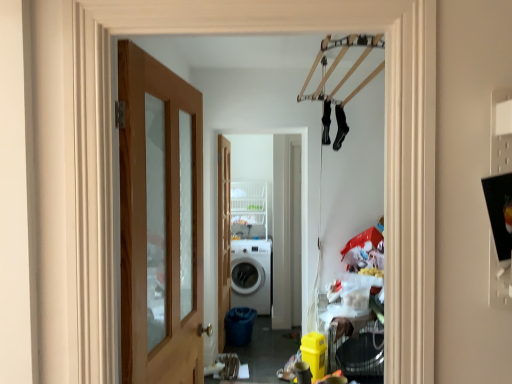
Describe the element at coordinates (224, 236) in the screenshot. I see `wooden door at center, placed as the 2th door when sorted from front to back` at that location.

What do you see at coordinates (160, 222) in the screenshot?
I see `wooden door at left, which is counted as the first door, starting from the front` at bounding box center [160, 222].

Locate an element on the screen. This screenshot has height=384, width=512. white wire shelf at center is located at coordinates 249,203.

From the image's perspective, is white matte washing machine at center under wooden door at center, placed as the 2th door when sorted from front to back?

Yes, from the image's perspective, white matte washing machine at center is beneath wooden door at center, placed as the 2th door when sorted from front to back.

Is white matte washing machine at center at the right side of wooden door at center, arranged as the 1th door when viewed from the back?

Result: Yes, white matte washing machine at center is to the right of wooden door at center, arranged as the 1th door when viewed from the back.

Consider the image. Which of these two, white matte washing machine at center or wooden door at center, placed as the 2th door when sorted from front to back, is thinner?

With smaller width is wooden door at center, placed as the 2th door when sorted from front to back.

I want to click on door that is the 2nd object located in front of the white matte washing machine at center, so click(160, 222).

Looking at their sizes, would you say wooden door at left, marked as the 2th door in a back-to-front arrangement, is wider or thinner than white matte washing machine at center?

Clearly, wooden door at left, marked as the 2th door in a back-to-front arrangement, has less width compared to white matte washing machine at center.

Which is more to the left, white matte washing machine at center or white wire shelf at center?

Positioned to the left is white wire shelf at center.

Considering the relative sizes of white matte washing machine at center and white wire shelf at center in the image provided, is white matte washing machine at center smaller than white wire shelf at center?

Incorrect, white matte washing machine at center is not smaller in size than white wire shelf at center.

Where is `shelf located behind the white matte washing machine at center`? shelf located behind the white matte washing machine at center is located at coordinates (249, 203).

Can you confirm if white matte washing machine at center is shorter than white wire shelf at center?

In fact, white matte washing machine at center may be taller than white wire shelf at center.

Considering the sizes of objects white wire shelf at center and wooden door at center, placed as the 2th door when sorted from front to back, in the image provided, who is thinner, white wire shelf at center or wooden door at center, placed as the 2th door when sorted from front to back,?

wooden door at center, placed as the 2th door when sorted from front to back, is thinner.

Can you confirm if white wire shelf at center is shorter than wooden door at center, arranged as the 1th door when viewed from the back?

Yes.

Is wooden door at center, placed as the 2th door when sorted from front to back, completely or partially inside white wire shelf at center?

No, wooden door at center, placed as the 2th door when sorted from front to back, is located outside of white wire shelf at center.

Considering the relative sizes of white wire shelf at center and wooden door at center, placed as the 2th door when sorted from front to back, in the image provided, is white wire shelf at center smaller than wooden door at center, placed as the 2th door when sorted from front to back,?

Indeed, white wire shelf at center has a smaller size compared to wooden door at center, placed as the 2th door when sorted from front to back.

From the image's perspective, is wooden door at left, which is counted as the first door, starting from the front, located above or below white wire shelf at center?

Based on their image positions, wooden door at left, which is counted as the first door, starting from the front, is located beneath white wire shelf at center.

Which is closer to the camera, (150,295) or (236,187)?

Point (150,295)

At what (x,y) coordinates should I click in order to perform the action: click on shelf below the wooden door at left, which is counted as the first door, starting from the front (from a real-world perspective). Please return your answer as a coordinate pair (x, y). Looking at the image, I should click on (249, 203).

Is wooden door at left, marked as the 2th door in a back-to-front arrangement, positioned far away from white wire shelf at center?

wooden door at left, marked as the 2th door in a back-to-front arrangement, is far away from white wire shelf at center.

Which is more to the left, white glossy washing machine at center or white wire shelf at center?

white wire shelf at center is more to the left.

Can you see white glossy washing machine at center touching white wire shelf at center?

white glossy washing machine at center and white wire shelf at center are not in contact.

Can you confirm if white glossy washing machine at center is wider than white wire shelf at center?

Incorrect, the width of white glossy washing machine at center does not surpass that of white wire shelf at center.

From the image's perspective, is white glossy washing machine at center beneath wooden door at center, placed as the 2th door when sorted from front to back?

Incorrect, from the image's perspective, white glossy washing machine at center is higher than wooden door at center, placed as the 2th door when sorted from front to back.

In the image, is white glossy washing machine at center on the left side or the right side of wooden door at center, placed as the 2th door when sorted from front to back?

In the image, white glossy washing machine at center appears on the right side of wooden door at center, placed as the 2th door when sorted from front to back.

Could you measure the distance between white glossy washing machine at center and wooden door at center, arranged as the 1th door when viewed from the back?

white glossy washing machine at center and wooden door at center, arranged as the 1th door when viewed from the back, are 29.12 inches apart from each other.

Is white glossy washing machine at center bigger than wooden door at center, placed as the 2th door when sorted from front to back?

Yes, white glossy washing machine at center is bigger than wooden door at center, placed as the 2th door when sorted from front to back.

Locate an element on the screen. The height and width of the screenshot is (384, 512). washing machine to the right of wooden door at center, arranged as the 1th door when viewed from the back is located at coordinates click(x=251, y=274).

Starting from the white matte washing machine at center, which door is the 2nd one to the left? Please provide its 2D coordinates.

[(160, 222)]

Considering their positions, is white matte washing machine at center positioned closer to white wire shelf at center than wooden door at left, which is counted as the first door, starting from the front?

white matte washing machine at center.

From the picture: When comparing their distances from wooden door at center, arranged as the 1th door when viewed from the back, does white wire shelf at center or wooden door at left, marked as the 2th door in a back-to-front arrangement, seem further?

Based on the image, wooden door at left, marked as the 2th door in a back-to-front arrangement, appears to be further to wooden door at center, arranged as the 1th door when viewed from the back.

Estimate the real-world distances between objects in this image. Which object is further from wooden door at left, which is counted as the first door, starting from the front, white matte washing machine at center or wooden door at center, arranged as the 1th door when viewed from the back?

Among the two, white matte washing machine at center is located further to wooden door at left, which is counted as the first door, starting from the front.

Which object lies nearer to the anchor point wooden door at left, marked as the 2th door in a back-to-front arrangement, white wire shelf at center or white glossy washing machine at center?

white glossy washing machine at center lies closer to wooden door at left, marked as the 2th door in a back-to-front arrangement, than the other object.

Estimate the real-world distances between objects in this image. Which object is further from white glossy washing machine at center, wooden door at center, arranged as the 1th door when viewed from the back, or white matte washing machine at center?

Based on the image, wooden door at center, arranged as the 1th door when viewed from the back, appears to be further to white glossy washing machine at center.

Considering their positions, is white glossy washing machine at center positioned further to wooden door at left, marked as the 2th door in a back-to-front arrangement, than white matte washing machine at center?

white matte washing machine at center is positioned further to the anchor wooden door at left, marked as the 2th door in a back-to-front arrangement.

Based on the photo, which object lies further to the anchor point white glossy washing machine at center, wooden door at center, arranged as the 1th door when viewed from the back, or wooden door at left, marked as the 2th door in a back-to-front arrangement?

wooden door at left, marked as the 2th door in a back-to-front arrangement, lies further to white glossy washing machine at center than the other object.

Considering their positions, is wooden door at center, arranged as the 1th door when viewed from the back, positioned further to white matte washing machine at center than white wire shelf at center?

The object further to white matte washing machine at center is wooden door at center, arranged as the 1th door when viewed from the back.

Find the location of a particular element. The image size is (512, 384). corridor between wooden door at left, which is counted as the first door, starting from the front, and white matte washing machine at center, along the z-axis is located at coordinates (268, 215).

The image size is (512, 384). Find the location of `washing machine between white glossy washing machine at center and white wire shelf at center along the z-axis`. washing machine between white glossy washing machine at center and white wire shelf at center along the z-axis is located at coordinates (251, 274).

Locate an element on the screen. This screenshot has width=512, height=384. corridor between wooden door at left, which is counted as the first door, starting from the front, and white wire shelf at center, along the z-axis is located at coordinates (268, 215).

Where is `washing machine positioned between wooden door at left, which is counted as the first door, starting from the front, and white wire shelf at center from near to far`? The width and height of the screenshot is (512, 384). washing machine positioned between wooden door at left, which is counted as the first door, starting from the front, and white wire shelf at center from near to far is located at coordinates (251, 274).